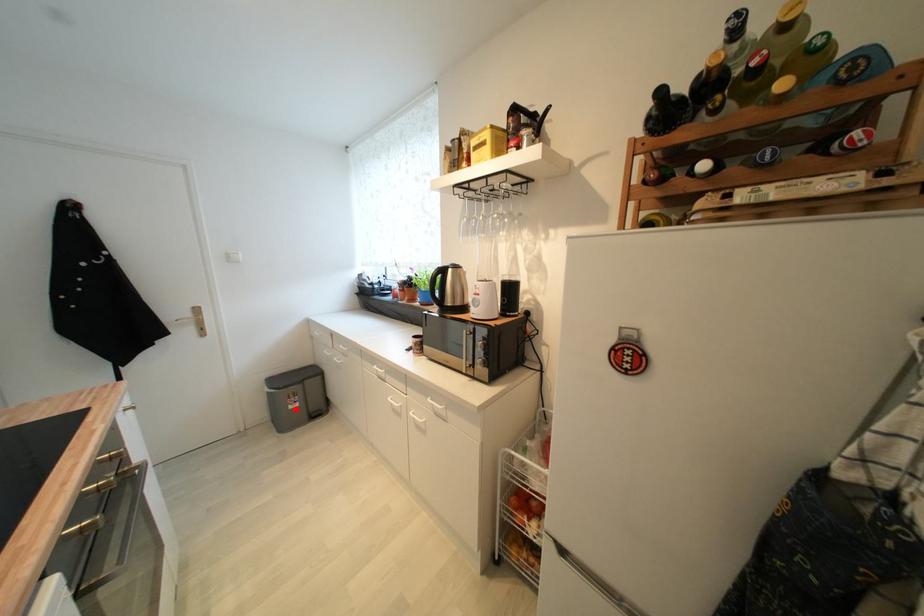
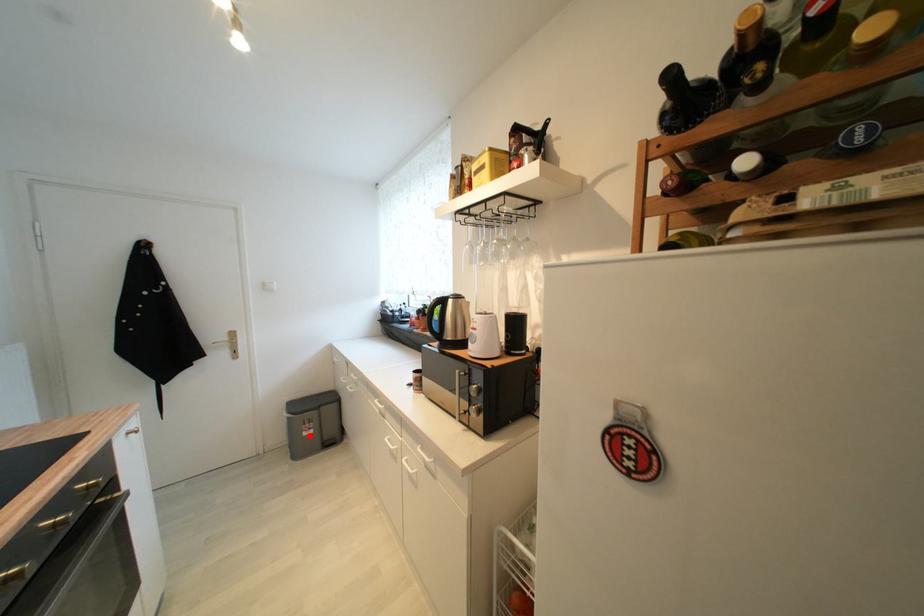
I am providing you with two images of the same scene from different viewpoints. A red point is marked on the first image and another point is marked on the second image. Are the points marked in image1 and image2 representing the same 3D position?

Yes